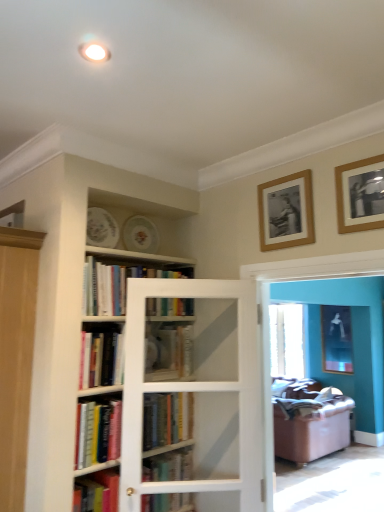
Locate an element on the screen. The image size is (384, 512). matte glass screen door at center, marked as the second screen door in a left-to-right arrangement is located at coordinates (353, 338).

What are the coordinates of `hardcover book at center, which is counted as the first book, starting from the bottom` in the screenshot? It's located at (169, 466).

In order to face hardcover book at center, the 2th book positioned from the bottom, should I rotate leftwards or rightwards?

To face it directly, rotate left by 4.809 degrees.

Describe the element at coordinates (336, 339) in the screenshot. I see `matte black picture frame at upper right, which ranks as the 3th picture frame in left-to-right order` at that location.

Measure the distance between wooden picture frame at upper right, arranged as the third picture frame when viewed from the back, and camera.

A distance of 1.67 meters exists between wooden picture frame at upper right, arranged as the third picture frame when viewed from the back, and camera.

This screenshot has width=384, height=512. In order to click on matte glass screen door at center, marked as the 1th screen door in a right-to-left arrangement in this screenshot , I will do `click(353, 338)`.

Consider the image. Which of these two, hardcover books at upper center, which is the 1th book from top to bottom, or hardcover book at center, placed as the fourth book when sorted from bottom to top, stands shorter?

Standing shorter between the two is hardcover book at center, placed as the fourth book when sorted from bottom to top.

Which of these two, hardcover books at upper center, which is the 1th book from top to bottom, or hardcover book at center, placed as the fourth book when sorted from bottom to top, is wider?

Wider between the two is hardcover book at center, placed as the fourth book when sorted from bottom to top.

Measure the distance between hardcover books at upper center, which is counted as the sixth book, starting from the bottom, and hardcover book at center, the 3th book positioned from the top.

Answer: The distance of hardcover books at upper center, which is counted as the sixth book, starting from the bottom, from hardcover book at center, the 3th book positioned from the top, is 11.12 inches.

Are hardcover books at upper center, which is the 1th book from top to bottom, and hardcover book at center, which is the 5th book from top to bottom, far apart?

No, hardcover books at upper center, which is the 1th book from top to bottom, is in close proximity to hardcover book at center, which is the 5th book from top to bottom.

From a real-world perspective, is hardcover books at upper center, which is counted as the sixth book, starting from the bottom, positioned above or below hardcover book at center, the 2th book positioned from the bottom?

hardcover books at upper center, which is counted as the sixth book, starting from the bottom, is above hardcover book at center, the 2th book positioned from the bottom.

Image resolution: width=384 pixels, height=512 pixels. What are the coordinates of `book that is the 2nd one when counting leftward from the hardcover book at center, the 2th book positioned from the bottom` in the screenshot? It's located at (116, 285).

Between hardcover books at upper center, which is the 1th book from top to bottom, and hardcover book at center, the 2th book positioned from the bottom, which one has larger width?

With larger width is hardcover book at center, the 2th book positioned from the bottom.

Is white glass cabinet at center, placed as the first screen door when sorted from left to right, at the back of hardcover book at center, which is counted as the first book, starting from the bottom?

No, hardcover book at center, which is counted as the first book, starting from the bottom, is not facing the opposite direction of white glass cabinet at center, placed as the first screen door when sorted from left to right.

Could you measure the distance between hardcover book at center, which is counted as the first book, starting from the bottom, and white glass cabinet at center, placed as the first screen door when sorted from left to right?

The distance of hardcover book at center, which is counted as the first book, starting from the bottom, from white glass cabinet at center, placed as the first screen door when sorted from left to right, is 12.54 inches.

Can you confirm if hardcover book at center, the sixth book from the top, is bigger than white glass cabinet at center, placed as the first screen door when sorted from left to right?

No, hardcover book at center, the sixth book from the top, is not bigger than white glass cabinet at center, placed as the first screen door when sorted from left to right.

Is hardcover book at center, the 3th book positioned from the top, not close to matte black picture frame at upper right, which ranks as the 3th picture frame in left-to-right order?

Absolutely, hardcover book at center, the 3th book positioned from the top, is distant from matte black picture frame at upper right, which ranks as the 3th picture frame in left-to-right order.

Is hardcover book at center, the 3th book positioned from the top, situated inside matte black picture frame at upper right, which ranks as the 3th picture frame in left-to-right order, or outside?

hardcover book at center, the 3th book positioned from the top, is located beyond the bounds of matte black picture frame at upper right, which ranks as the 3th picture frame in left-to-right order.

Is hardcover book at center, the 3th book positioned from the top, turned away from matte black picture frame at upper right, acting as the 1th picture frame starting from the bottom?

No, hardcover book at center, the 3th book positioned from the top, is not facing away from matte black picture frame at upper right, acting as the 1th picture frame starting from the bottom.

From the image's perspective, which one is positioned lower, hardcover book at center, the 3th book positioned from the top, or matte black picture frame at upper right, which ranks as the 3th picture frame in left-to-right order?

matte black picture frame at upper right, which ranks as the 3th picture frame in left-to-right order, is shown below in the image.

Locate an element on the screen. the 3rd picture frame counting from the right side of the hardcover book at center, which is the 5th book from top to bottom is located at coordinates (336, 339).

Considering the points (326, 364) and (159, 393), which point is behind, point (326, 364) or point (159, 393)?

Point (326, 364)

From the image's perspective, is matte black picture frame at upper right, acting as the 1th picture frame starting from the right, located above or below hardcover book at center, the 2th book positioned from the bottom?

Clearly, from the image's perspective, matte black picture frame at upper right, acting as the 1th picture frame starting from the right, is below hardcover book at center, the 2th book positioned from the bottom.

From a real-world perspective, does matte black picture frame at upper right, marked as the 1th picture frame in a back-to-front arrangement, stand above hardcover book at center, which is the 5th book from top to bottom?

Yes, from a real-world perspective, matte black picture frame at upper right, marked as the 1th picture frame in a back-to-front arrangement, is on top of hardcover book at center, which is the 5th book from top to bottom.

Which of these two, hardcover book at center, the 3th book positioned from the top, or matte glass screen door at center, marked as the second screen door in a left-to-right arrangement, is smaller?

hardcover book at center, the 3th book positioned from the top.

Does point (168, 336) lie in front of point (365, 350)?

Yes, point (168, 336) is closer to viewer.

Is hardcover book at center, placed as the fourth book when sorted from bottom to top, surrounding matte glass screen door at center, marked as the second screen door in a left-to-right arrangement?

No, matte glass screen door at center, marked as the second screen door in a left-to-right arrangement, is located outside of hardcover book at center, placed as the fourth book when sorted from bottom to top.

Can you tell me how much hardcover book at center, placed as the fourth book when sorted from bottom to top, and matte glass screen door at center, marked as the 1th screen door in a right-to-left arrangement, differ in facing direction?

89.8 degrees.

Is white glass cabinet at center, marked as the second screen door in a right-to-left arrangement, looking in the opposite direction of hardcover book at center, which is counted as the first book, starting from the bottom?

That's right, white glass cabinet at center, marked as the second screen door in a right-to-left arrangement, is facing away from hardcover book at center, which is counted as the first book, starting from the bottom.

Is white glass cabinet at center, placed as the first screen door when sorted from left to right, bigger or smaller than hardcover book at center, which is counted as the first book, starting from the bottom?

In the image, white glass cabinet at center, placed as the first screen door when sorted from left to right, appears to be larger than hardcover book at center, which is counted as the first book, starting from the bottom.

Is white glass cabinet at center, marked as the second screen door in a right-to-left arrangement, not within hardcover book at center, the sixth book from the top?

Yes, white glass cabinet at center, marked as the second screen door in a right-to-left arrangement, is outside of hardcover book at center, the sixth book from the top.

Identify the location of book that is the 1st one below the hardcover books at upper center, which is counted as the sixth book, starting from the bottom (from a real-world perspective). (169, 353).

From the hardcover books at upper center, which is counted as the sixth book, starting from the bottom, count 2nd books backward and point to it. Please provide its 2D coordinates.

[(167, 418)]

Estimate the real-world distances between objects in this image. Which object is further from hardcover book at center, the 3th book positioned from the top, hardcover books at upper center, which is the 1th book from top to bottom, or matte black picture frame at upper right, which ranks as the 3th picture frame in left-to-right order?

The object further to hardcover book at center, the 3th book positioned from the top, is matte black picture frame at upper right, which ranks as the 3th picture frame in left-to-right order.

Estimate the real-world distances between objects in this image. Which object is closer to matte glass screen door at center, marked as the second screen door in a left-to-right arrangement, wooden picture frame at upper right, positioned as the 3th picture frame in bottom-to-top order, or hardcover books at upper center, which is counted as the sixth book, starting from the bottom?

hardcover books at upper center, which is counted as the sixth book, starting from the bottom.

Based on their spatial positions, is white glass cabinet at center, marked as the second screen door in a right-to-left arrangement, or hardcover books at center, placed as the fifth book when sorted from bottom to top, further from matte black picture frame at upper right, acting as the 1th picture frame starting from the right?

hardcover books at center, placed as the fifth book when sorted from bottom to top, is positioned further to the anchor matte black picture frame at upper right, acting as the 1th picture frame starting from the right.

Which object lies further to the anchor point wooden picture frame at upper right, positioned as the 3th picture frame in bottom-to-top order, wooden picture frame at upper right, the 2th picture frame in the back-to-front sequence, or hardcover book at center, the 2th book positioned from the bottom?

hardcover book at center, the 2th book positioned from the bottom, lies further to wooden picture frame at upper right, positioned as the 3th picture frame in bottom-to-top order, than the other object.

Considering their positions, is hardcover book at center, which is the 5th book from top to bottom, positioned further to hardcover books at upper center, which is the 1th book from top to bottom, than wooden picture frame at upper right, arranged as the third picture frame when viewed from the back?

wooden picture frame at upper right, arranged as the third picture frame when viewed from the back, is further to hardcover books at upper center, which is the 1th book from top to bottom.

Estimate the real-world distances between objects in this image. Which object is further from white glass cabinet at center, placed as the first screen door when sorted from left to right, hardcover books at upper center, which is counted as the sixth book, starting from the bottom, or wooden picture frame at upper right, acting as the first picture frame starting from the top?

Among the two, wooden picture frame at upper right, acting as the first picture frame starting from the top, is located further to white glass cabinet at center, placed as the first screen door when sorted from left to right.

Based on their spatial positions, is hardcover book at center, which is counted as the first book, starting from the bottom, or white glass cabinet at center, marked as the second screen door in a right-to-left arrangement, closer to hardcover book at center, placed as the fourth book when sorted from bottom to top?

white glass cabinet at center, marked as the second screen door in a right-to-left arrangement, is positioned closer to the anchor hardcover book at center, placed as the fourth book when sorted from bottom to top.

When comparing their distances from hardcover book at center, the 3th book positioned from the top, does matte black picture frame at upper right, the third picture frame positioned from the front, or hardcover book at center, the sixth book from the top, seem closer?

hardcover book at center, the sixth book from the top, lies closer to hardcover book at center, the 3th book positioned from the top, than the other object.

The width and height of the screenshot is (384, 512). I want to click on picture frame between wooden picture frame at upper right, arranged as the third picture frame when viewed from the back, and matte glass screen door at center, marked as the second screen door in a left-to-right arrangement, vertically, so click(x=286, y=212).

Where is `picture frame between hardcover books at upper center, which is the 1th book from top to bottom, and matte glass screen door at center, marked as the 1th screen door in a right-to-left arrangement`? This screenshot has width=384, height=512. picture frame between hardcover books at upper center, which is the 1th book from top to bottom, and matte glass screen door at center, marked as the 1th screen door in a right-to-left arrangement is located at coordinates (x=286, y=212).

Locate an element on the screen. picture frame positioned between white glass cabinet at center, marked as the second screen door in a right-to-left arrangement, and matte black picture frame at upper right, the third picture frame positioned from the front, from near to far is located at coordinates (286, 212).

Locate an element on the screen. This screenshot has width=384, height=512. book between hardcover book at lower left, acting as the fourth book starting from the top, and hardcover book at center, which is counted as the first book, starting from the bottom, from top to bottom is located at coordinates coord(167,418).